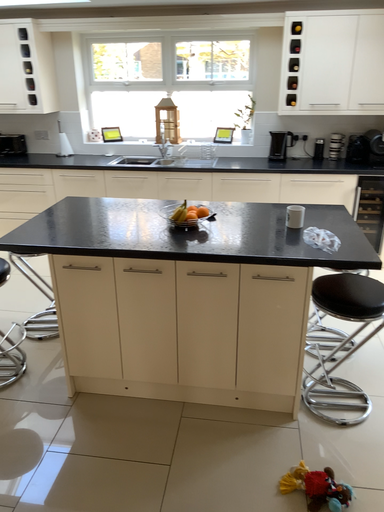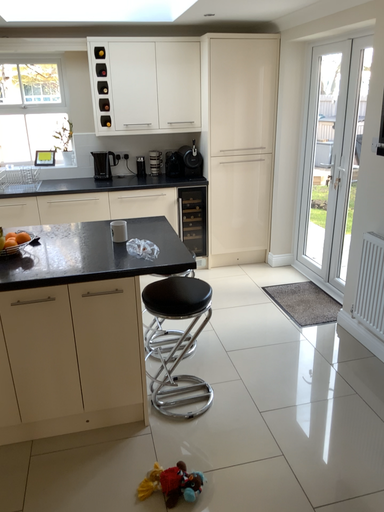
Question: How did the camera likely rotate when shooting the video?

Choices:
 (A) rotated left
 (B) rotated right

Answer: (B)